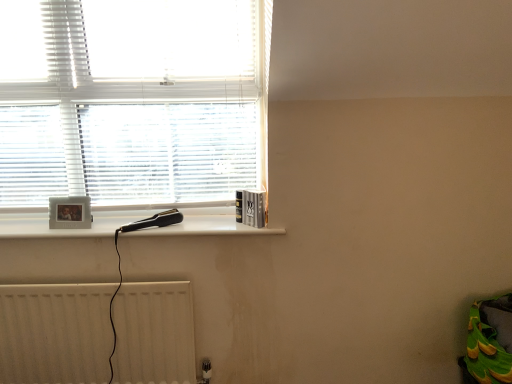
Image resolution: width=512 pixels, height=384 pixels. Find the location of `free spot above white textured radiator at lower left (from a real-world perspective)`. free spot above white textured radiator at lower left (from a real-world perspective) is located at coordinates (x=81, y=277).